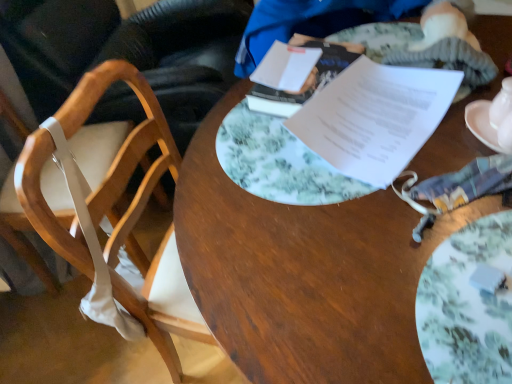
Find the location of a particular element. The image size is (512, 384). vacant space situated on the left part of porcelain floral plate at center is located at coordinates (306, 297).